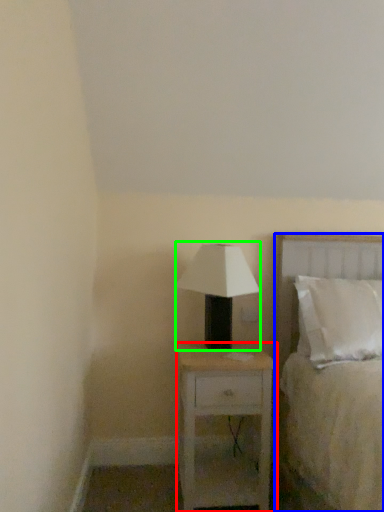
Question: Based on their relative distances, which object is nearer to nightstand (highlighted by a red box)? Choose from bed (highlighted by a blue box) and table lamp (highlighted by a green box).

Choices:
 (A) bed
 (B) table lamp

Answer: (A)